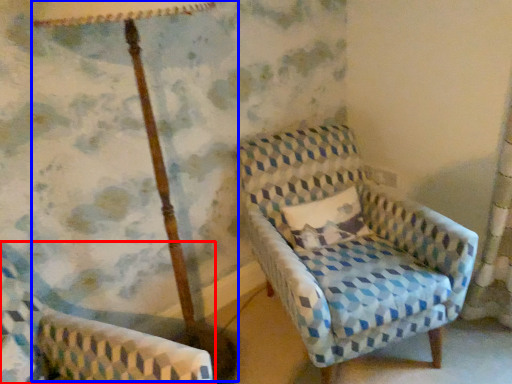
Question: Which object is closer to the camera taking this photo, chair (highlighted by a red box) or table lamp (highlighted by a blue box)?

Choices:
 (A) chair
 (B) table lamp

Answer: (A)